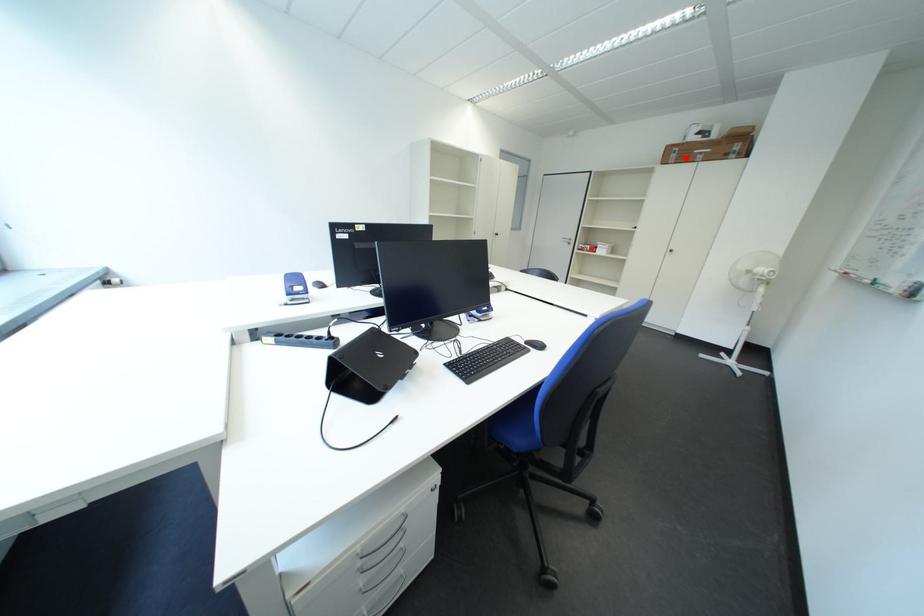
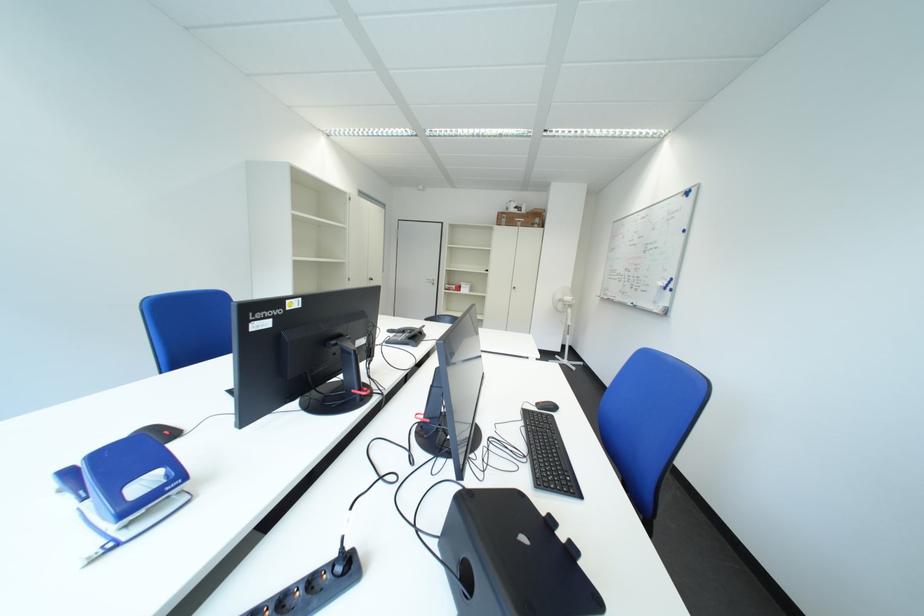
Find the pixel in the second image that matches the highlighted location in the first image.

(517, 223)